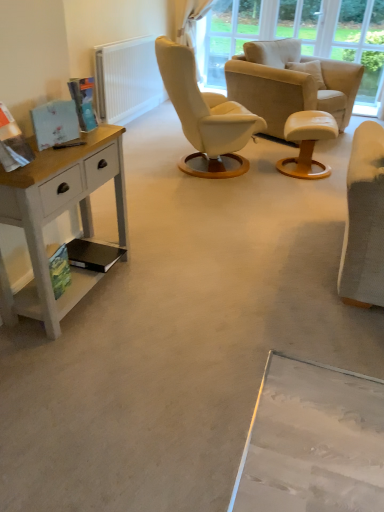
Question: Would you say white leather stool at center is outside white painted wood desk at left?

Choices:
 (A) no
 (B) yes

Answer: (B)

Question: Is white leather stool at center positioned with its back to white painted wood desk at left?

Choices:
 (A) no
 (B) yes

Answer: (A)

Question: From a real-world perspective, is white leather stool at center positioned under white painted wood desk at left based on gravity?

Choices:
 (A) yes
 (B) no

Answer: (A)

Question: Does white leather stool at center come behind white painted wood desk at left?

Choices:
 (A) no
 (B) yes

Answer: (B)

Question: Can you confirm if white leather stool at center is wider than white painted wood desk at left?

Choices:
 (A) yes
 (B) no

Answer: (A)

Question: From a real-world perspective, is white leather stool at center physically above white painted wood desk at left?

Choices:
 (A) no
 (B) yes

Answer: (A)

Question: Is beige fabric armchair at center surrounded by white painted wood desk at left?

Choices:
 (A) yes
 (B) no

Answer: (B)

Question: Is white painted wood desk at left positioned behind beige fabric armchair at center?

Choices:
 (A) no
 (B) yes

Answer: (A)

Question: From the image's perspective, would you say white painted wood desk at left is positioned over beige fabric armchair at center?

Choices:
 (A) no
 (B) yes

Answer: (A)

Question: Does white painted wood desk at left turn towards beige fabric armchair at center?

Choices:
 (A) yes
 (B) no

Answer: (B)

Question: Is white painted wood desk at left turned away from beige fabric armchair at center?

Choices:
 (A) yes
 (B) no

Answer: (B)

Question: Would you say white painted wood desk at left is a long distance from beige fabric armchair at center?

Choices:
 (A) no
 (B) yes

Answer: (B)

Question: Does transparent glass window screen at upper center appear on the right side of white leather stool at center?

Choices:
 (A) no
 (B) yes

Answer: (A)